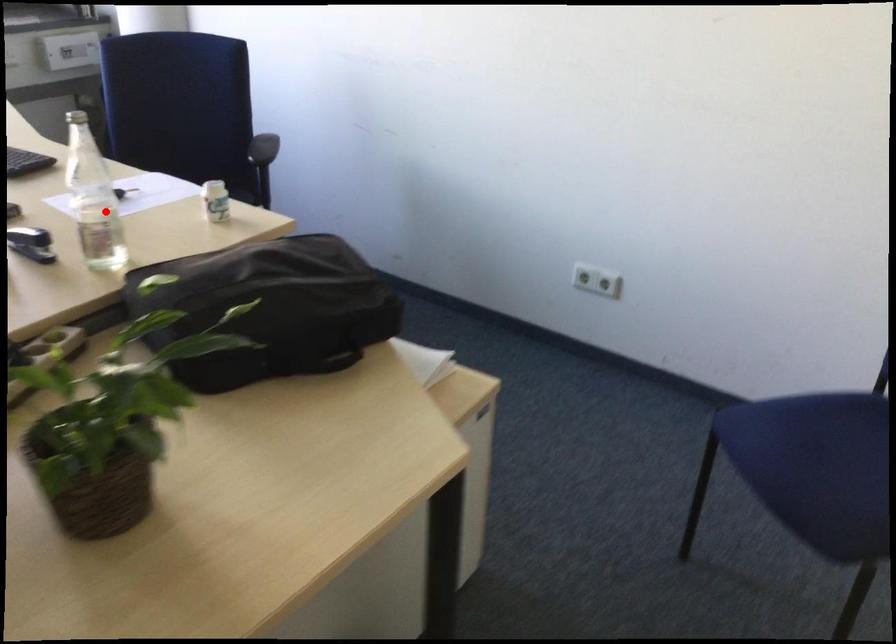
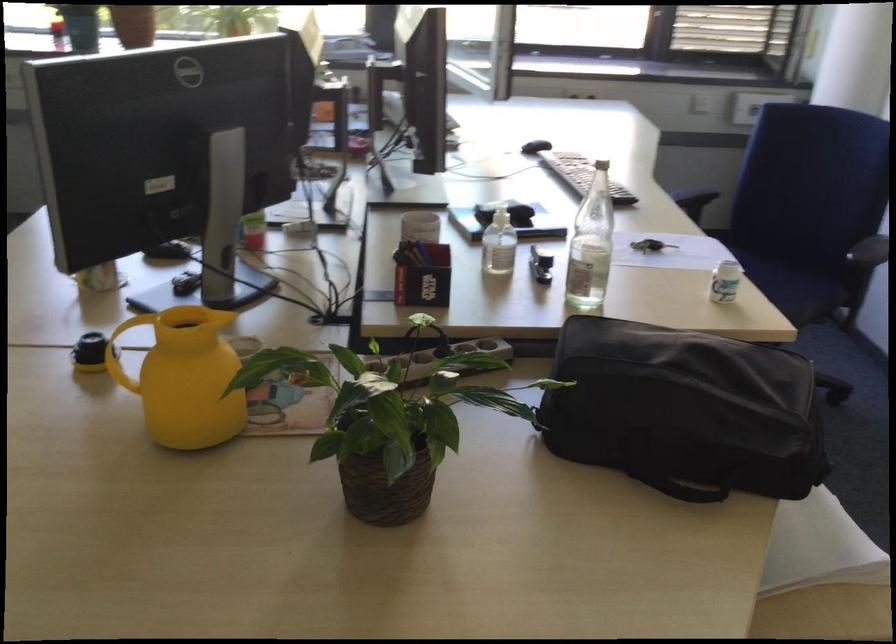
Question: I am providing you with two images of the same scene from different viewpoints. A red point is marked on the first image. Is the red point's position out of view in image 2?

Choices:
 (A) Yes
 (B) No

Answer: (B)